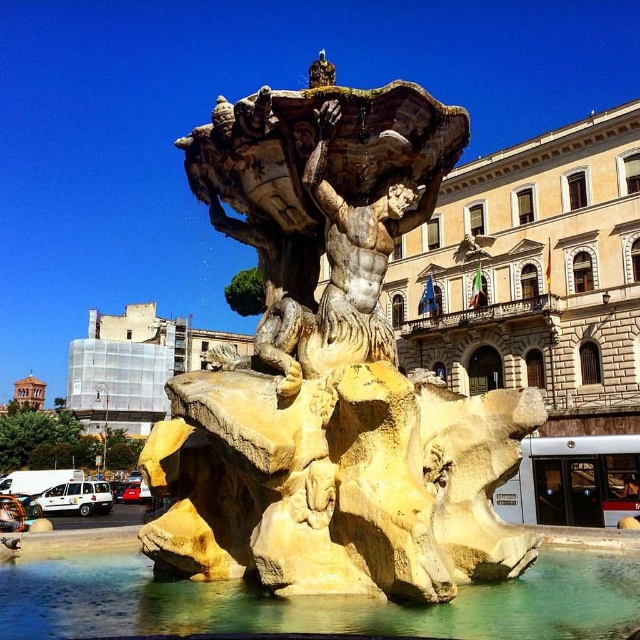
You are standing in the public square and want to locate the yellow stone fountain at center. According to the coordinates provided, where would you find it?

The yellow stone fountain at center is located at point [330,369].

You are standing in the public square facing the fountain. You notice the yellow stone fountain at center and the clear water at fountain center. Which object is positioned to the left of the other?

The clear water at fountain center is to the left of the yellow stone fountain at center because the yellow stone fountain at center is to the right of clear water at fountain center.